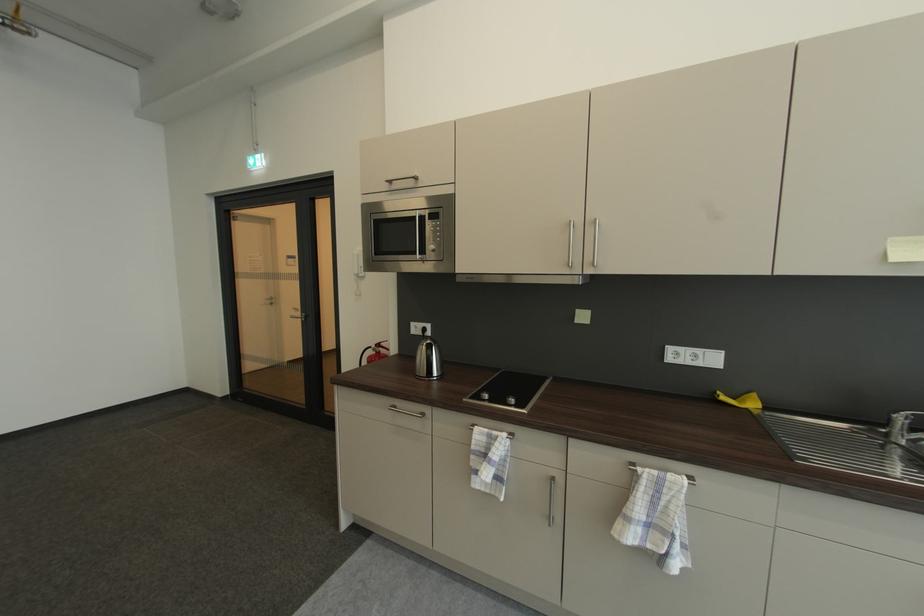
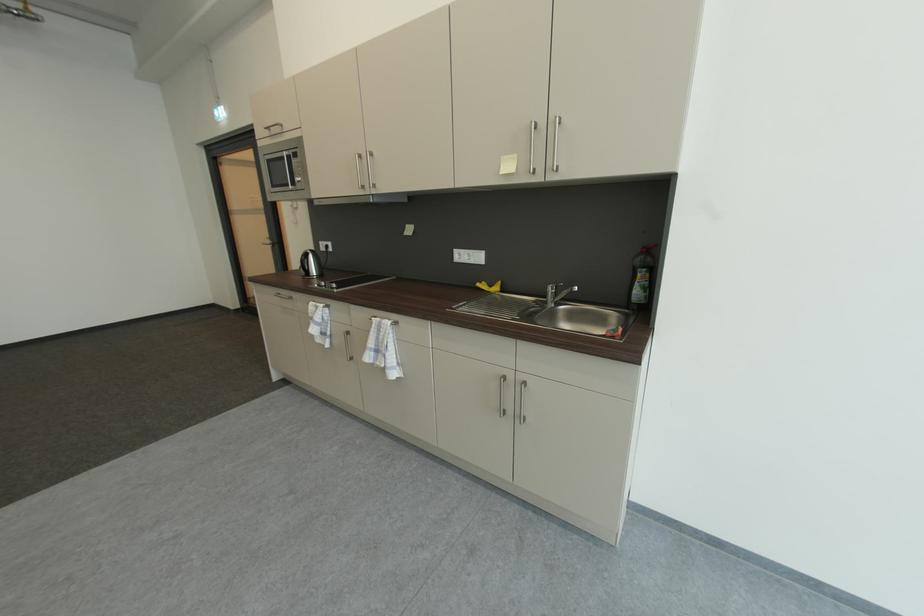
Locate, in the second image, the point that corresponds to (393,183) in the first image.

(273, 130)